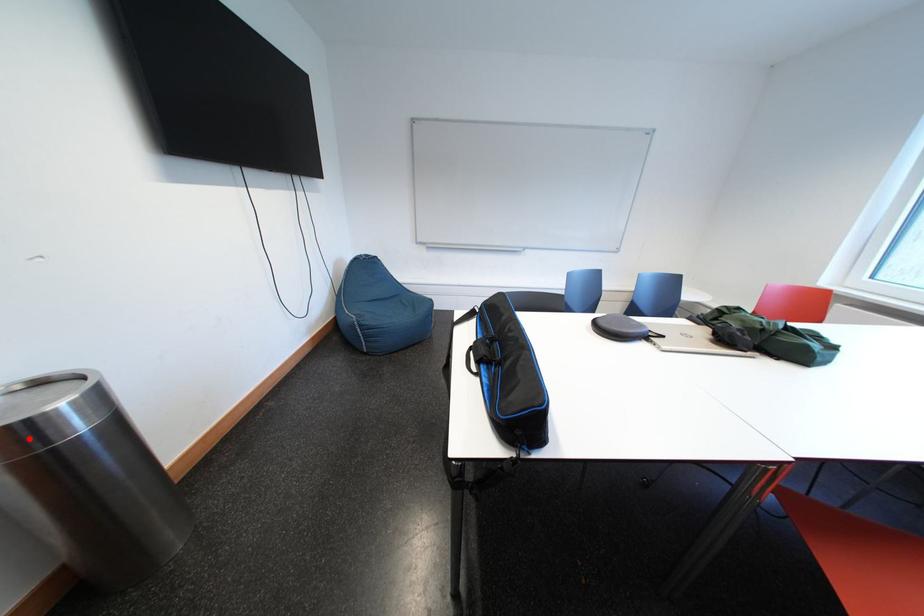
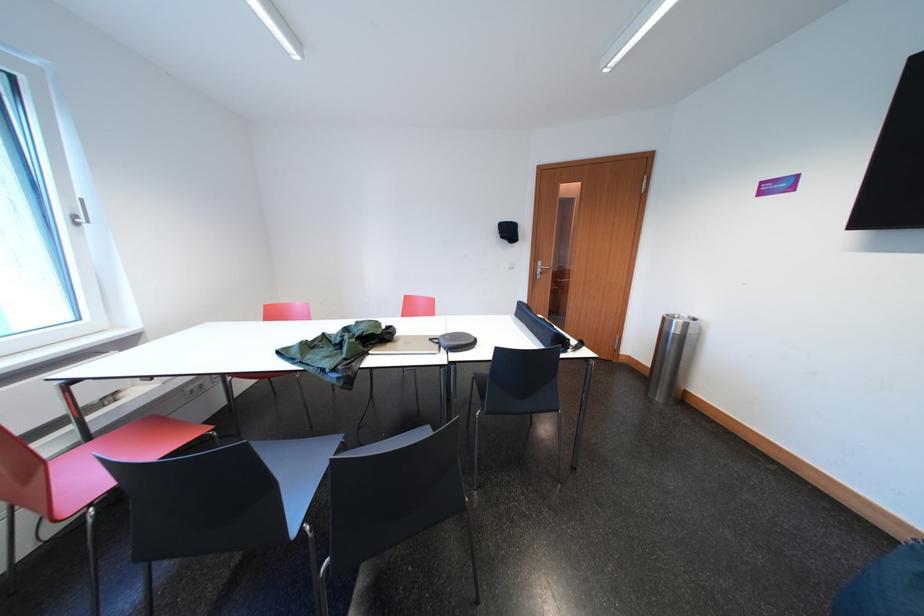
Question: I am providing you with two images of the same scene from different viewpoints. Given a red point in image1, look at the same physical point in image2. Is it:

Choices:
 (A) Closer to the viewpoint
 (B) Farther from the viewpoint

Answer: (B)